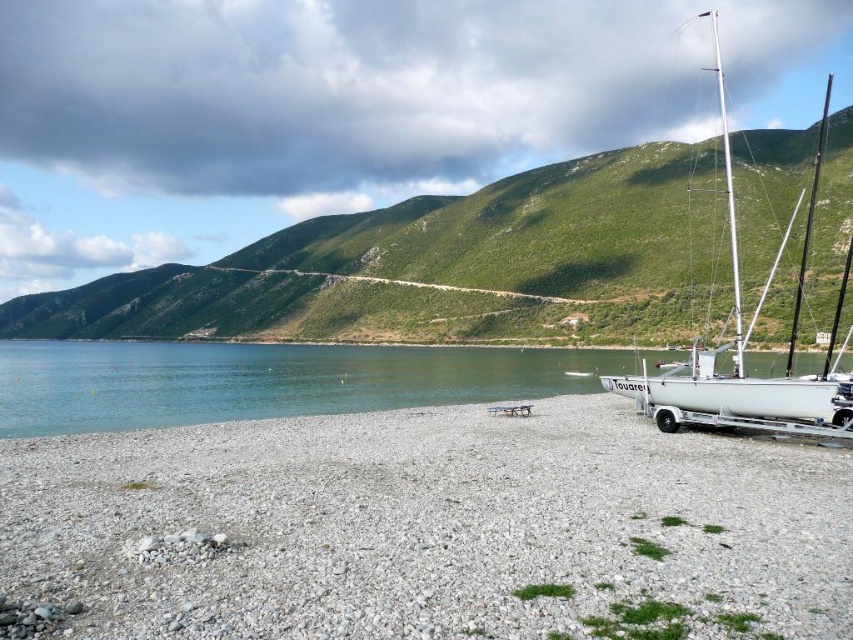
Between gray gravelly sand at lower left and white glossy sailboat at right, which one has more height?

white glossy sailboat at right is taller.

Who is positioned more to the right, gray gravelly sand at lower left or white glossy sailboat at right?

white glossy sailboat at right

This screenshot has width=853, height=640. What do you see at coordinates (425, 525) in the screenshot?
I see `gray gravelly sand at lower left` at bounding box center [425, 525].

Where is `gray gravelly sand at lower left`? Image resolution: width=853 pixels, height=640 pixels. gray gravelly sand at lower left is located at coordinates (425, 525).